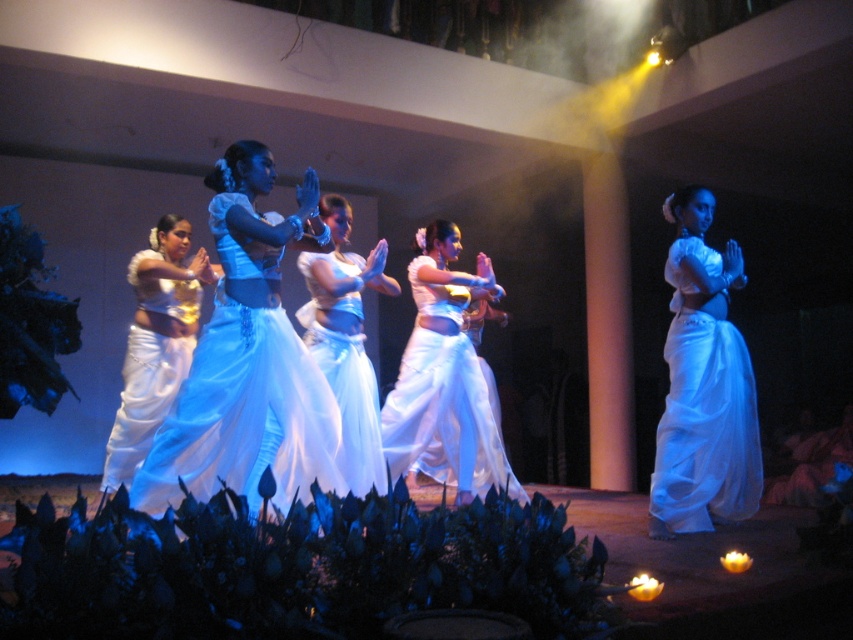
You are a photographer positioned at the front of the stage. You want to capture a closeup of the skirt that is nearest to you. Which skirt should you focus on, the matte white skirt at center or the white silk skirt at center?

The matte white skirt at center is closer to the viewer than the white silk skirt at center, so you should focus on the matte white skirt at center for the closeup.